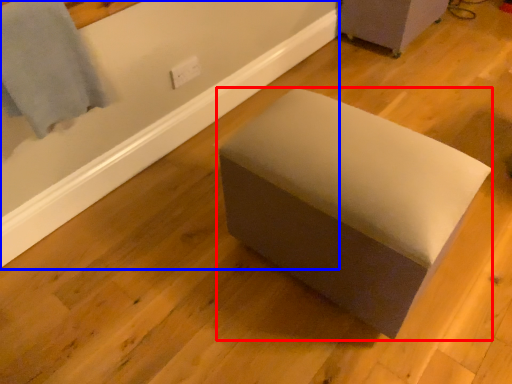
Question: Which point is closer to the camera, furniture (highlighted by a red box) or bath (highlighted by a blue box)?

Choices:
 (A) furniture
 (B) bath

Answer: (A)